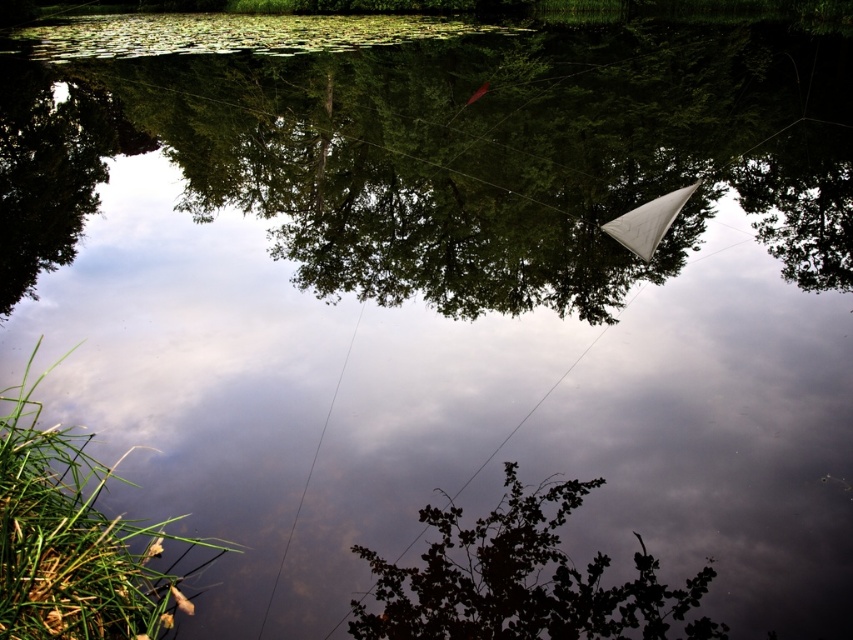
Question: Can you confirm if dark green leafy tree at center is positioned to the left of white fabric kite at upper right?

Choices:
 (A) yes
 (B) no

Answer: (A)

Question: Which point is closer to the camera taking this photo?

Choices:
 (A) (515, 497)
 (B) (471, 93)
 (C) (601, 228)
 (D) (334, 392)

Answer: (A)

Question: Among these objects, which one is farthest from the camera?

Choices:
 (A) dark green leafy tree at center
 (B) clear wire at center
 (C) white fabric kite at upper right

Answer: (C)

Question: Does white fabric kite at upper right come in front of translucent pink kite at upper center?

Choices:
 (A) no
 (B) yes

Answer: (B)

Question: Which point is farther to the camera?

Choices:
 (A) clear wire at center
 (B) dark green leafy tree at center

Answer: (A)

Question: Where is dark green leafy tree at center located in relation to white fabric kite at upper right in the image?

Choices:
 (A) below
 (B) above

Answer: (A)